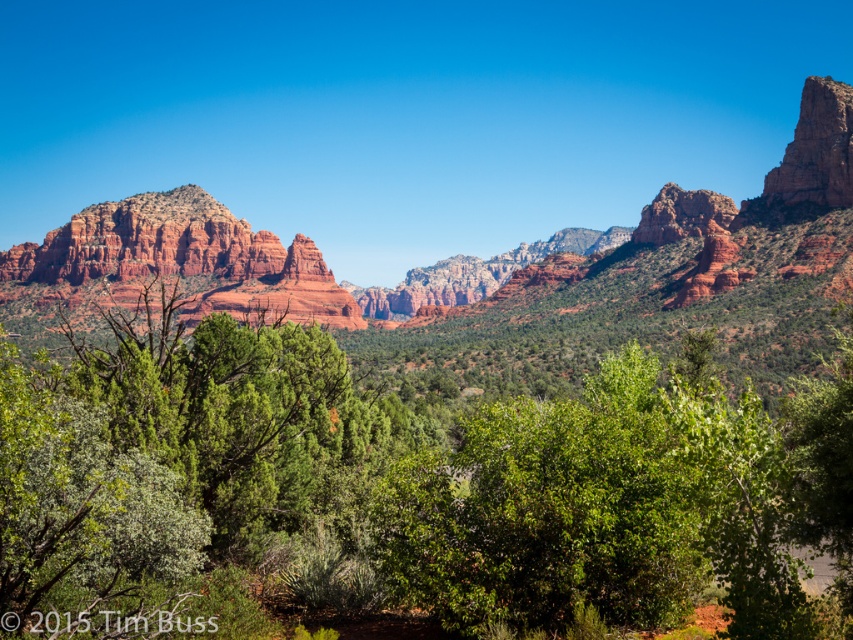
Is green leafy tree at center shorter than reddish-brown rock formation at center?

Correct, green leafy tree at center is not as tall as reddish-brown rock formation at center.

At what (x,y) coordinates should I click in order to perform the action: click on green leafy tree at center. Please return your answer as a coordinate pair (x, y). The width and height of the screenshot is (853, 640). Looking at the image, I should click on (412, 484).

What are the coordinates of `green leafy tree at center` in the screenshot? It's located at (412, 484).